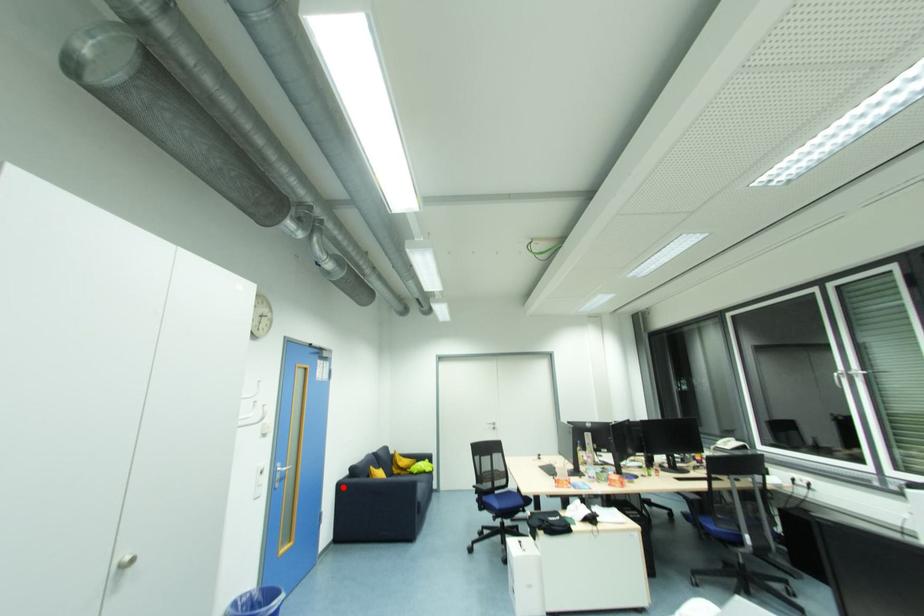
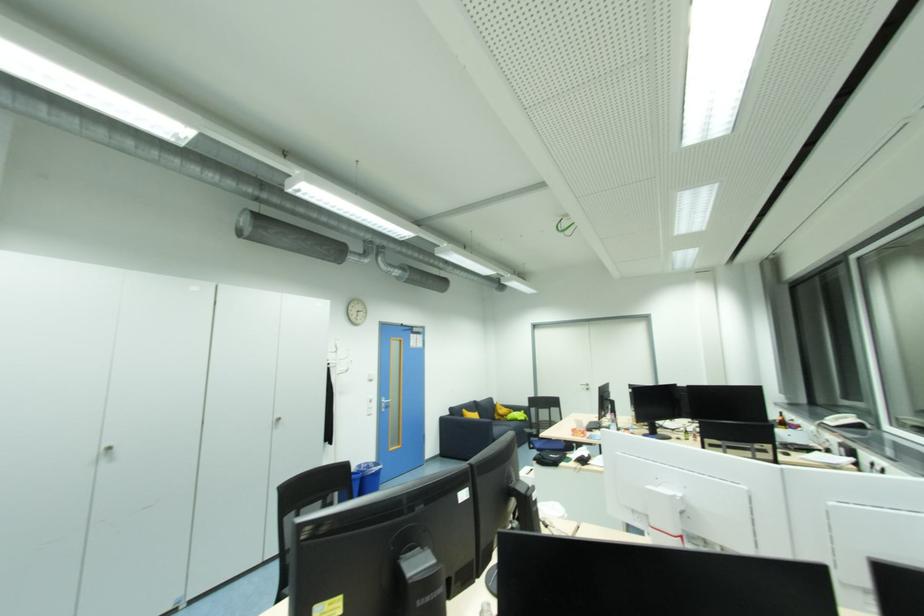
Question: I am providing you with two images of the same scene from different viewpoints. A red point is marked on the first image. At the location where the point appears in image 1, is it still visible in image 2?

Choices:
 (A) Yes
 (B) No

Answer: (A)